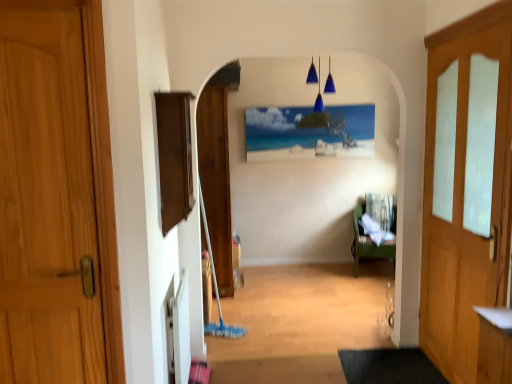
Question: Is blue glass pendant lights at upper center a part of wooden door at left, which is the third door from back to front?

Choices:
 (A) no
 (B) yes

Answer: (A)

Question: Considering the relative sizes of wooden door at left, which ranks as the first door in front-to-back order, and blue glass pendant lights at upper center in the image provided, is wooden door at left, which ranks as the first door in front-to-back order, bigger than blue glass pendant lights at upper center?

Choices:
 (A) yes
 (B) no

Answer: (A)

Question: Can you confirm if wooden door at left, the 3th door when ordered from right to left, is positioned to the left of blue glass pendant lights at upper center?

Choices:
 (A) no
 (B) yes

Answer: (B)

Question: Considering the relative sizes of wooden door at left, which ranks as the first door in front-to-back order, and blue glass pendant lights at upper center in the image provided, is wooden door at left, which ranks as the first door in front-to-back order, thinner than blue glass pendant lights at upper center?

Choices:
 (A) no
 (B) yes

Answer: (B)

Question: From the image's perspective, would you say wooden door at left, which is the third door from back to front, is positioned over blue glass pendant lights at upper center?

Choices:
 (A) yes
 (B) no

Answer: (B)

Question: From a real-world perspective, does wooden door at left, the 3th door when ordered from right to left, sit lower than blue glass pendant lights at upper center?

Choices:
 (A) yes
 (B) no

Answer: (A)

Question: From a real-world perspective, is dark gray rubber doormat at lower center positioned over blue glass pendant lights at upper center based on gravity?

Choices:
 (A) no
 (B) yes

Answer: (A)

Question: Does dark gray rubber doormat at lower center have a greater width compared to blue glass pendant lights at upper center?

Choices:
 (A) yes
 (B) no

Answer: (A)

Question: Is dark gray rubber doormat at lower center at the right side of blue glass pendant lights at upper center?

Choices:
 (A) yes
 (B) no

Answer: (A)

Question: Can you confirm if dark gray rubber doormat at lower center is smaller than blue glass pendant lights at upper center?

Choices:
 (A) no
 (B) yes

Answer: (B)

Question: From a real-world perspective, is dark gray rubber doormat at lower center physically below blue glass pendant lights at upper center?

Choices:
 (A) yes
 (B) no

Answer: (A)

Question: Does dark gray rubber doormat at lower center come behind blue glass pendant lights at upper center?

Choices:
 (A) no
 (B) yes

Answer: (A)

Question: From the image's perspective, would you say wooden door at center, which is counted as the second door, starting from the right, is shown under green wicker chair at center-right?

Choices:
 (A) no
 (B) yes

Answer: (A)